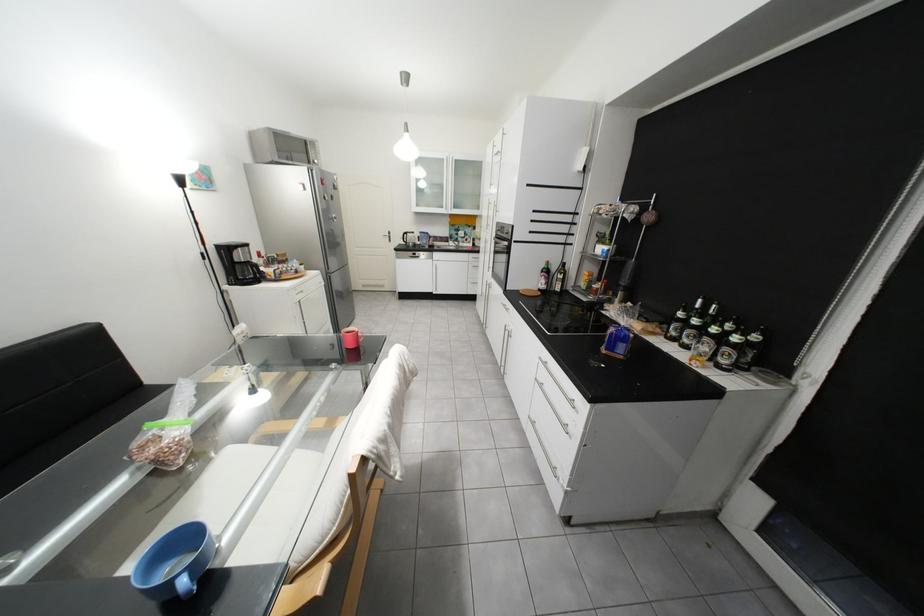
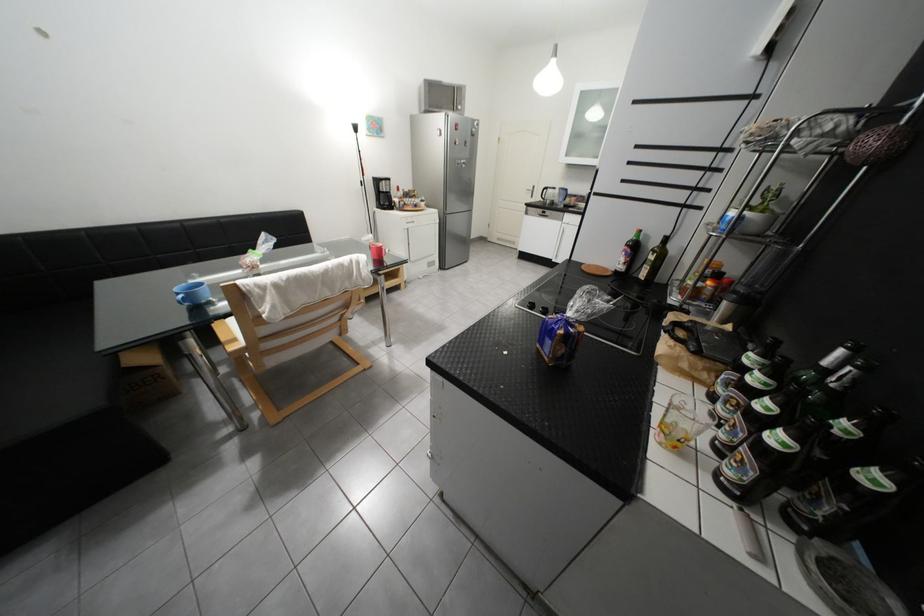
Find the pixel in the second image that matches pixel 402 233 in the first image.

(545, 188)